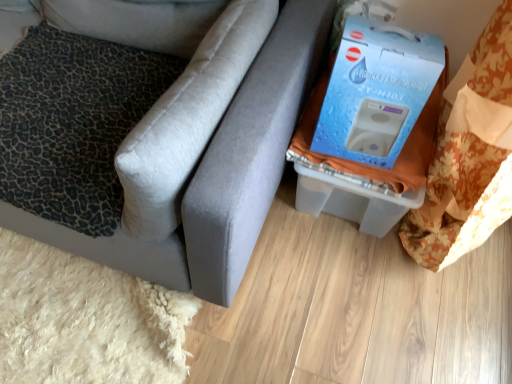
Question: From a real-world perspective, is leopard print fabric pillow at left, which ranks as the second pillow in top-to-bottom order, physically above matte gray couch at lower right?

Choices:
 (A) no
 (B) yes

Answer: (A)

Question: Is leopard print fabric pillow at left, acting as the 1th pillow starting from the bottom, not within matte gray couch at lower right?

Choices:
 (A) yes
 (B) no

Answer: (B)

Question: Is leopard print fabric pillow at left, acting as the 1th pillow starting from the bottom, looking in the opposite direction of matte gray couch at lower right?

Choices:
 (A) yes
 (B) no

Answer: (A)

Question: Is leopard print fabric pillow at left, acting as the 1th pillow starting from the bottom, wider than matte gray couch at lower right?

Choices:
 (A) yes
 (B) no

Answer: (B)

Question: Is leopard print fabric pillow at left, acting as the 1th pillow starting from the bottom, at the left side of matte gray couch at lower right?

Choices:
 (A) yes
 (B) no

Answer: (B)

Question: Considering their positions, is leopard print fabric pillow at left, acting as the 1th pillow starting from the bottom, located in front of or behind matte gray couch at lower right?

Choices:
 (A) front
 (B) behind

Answer: (B)

Question: Considering the positions of leopard print fabric pillow at left, which ranks as the second pillow in top-to-bottom order, and matte gray couch at lower right in the image, is leopard print fabric pillow at left, which ranks as the second pillow in top-to-bottom order, taller or shorter than matte gray couch at lower right?

Choices:
 (A) tall
 (B) short

Answer: (B)

Question: From a real-world perspective, is leopard print fabric pillow at left, acting as the 1th pillow starting from the bottom, positioned above or below matte gray couch at lower right?

Choices:
 (A) below
 (B) above

Answer: (A)

Question: Considering the relative positions of leopard print fabric pillow at left, acting as the 1th pillow starting from the bottom, and matte gray couch at lower right in the image provided, is leopard print fabric pillow at left, acting as the 1th pillow starting from the bottom, to the left or to the right of matte gray couch at lower right?

Choices:
 (A) right
 (B) left

Answer: (A)

Question: Considering their positions, is leopard print fabric pillow at left, which ranks as the second pillow in top-to-bottom order, located in front of or behind leopard print cushion at left, positioned as the first pillow in top-to-bottom order?

Choices:
 (A) behind
 (B) front

Answer: (B)

Question: From their relative heights in the image, would you say leopard print fabric pillow at left, acting as the 1th pillow starting from the bottom, is taller or shorter than leopard print cushion at left, positioned as the first pillow in top-to-bottom order?

Choices:
 (A) short
 (B) tall

Answer: (A)

Question: Considering the positions of point (136, 120) and point (146, 3), is point (136, 120) closer or farther from the camera than point (146, 3)?

Choices:
 (A) closer
 (B) farther

Answer: (A)

Question: Based on their positions, is leopard print fabric pillow at left, acting as the 1th pillow starting from the bottom, located to the left or right of leopard print cushion at left, positioned as the second pillow in bottom-to-top order?

Choices:
 (A) right
 (B) left

Answer: (B)

Question: Relative to leopard print fabric pillow at left, acting as the 1th pillow starting from the bottom, is matte gray couch at lower right in front or behind?

Choices:
 (A) front
 (B) behind

Answer: (A)

Question: Is matte gray couch at lower right bigger or smaller than leopard print fabric pillow at left, acting as the 1th pillow starting from the bottom?

Choices:
 (A) small
 (B) big

Answer: (B)